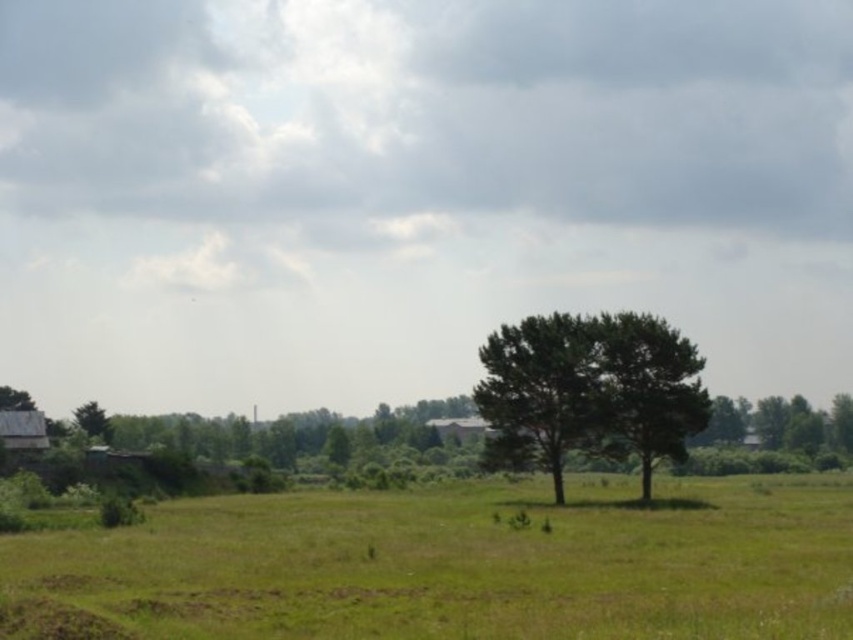
Question: Is green grass at lower center to the left of green leafy tree at center from the viewer's perspective?

Choices:
 (A) yes
 (B) no

Answer: (A)

Question: Does green grass at lower center appear over green leafy tree at center?

Choices:
 (A) no
 (B) yes

Answer: (A)

Question: Which object is farther from the camera taking this photo?

Choices:
 (A) green leafy tree at center
 (B) green grass at lower center

Answer: (A)

Question: Is green grass at lower center bigger than green leafy tree at center?

Choices:
 (A) yes
 (B) no

Answer: (A)

Question: Which object appears farthest from the camera in this image?

Choices:
 (A) green grass at lower center
 (B) green leafy tree at center

Answer: (B)